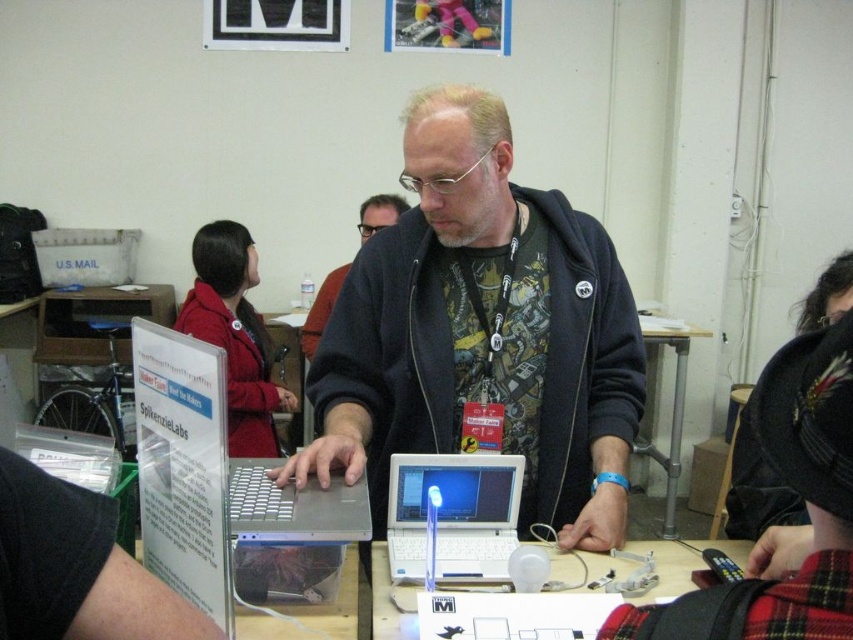
You are standing in front of the SpikenzieLabs display at the maker faire. There are two points marked on the table where the man is demonstrating the laptop. The first point is at coordinate (x=306, y=497) and the second point is at (x=238, y=257). Which point is closer to you?

Point (x=306, y=497) is closer to the viewer than point (x=238, y=257).

You are at a maker faire and want to place a 12 inch promotional banner between the brushed metal sign at upper left and the white plastic laptop at center. Is there enough space?

The distance between the brushed metal sign at upper left and the white plastic laptop at center is 24.00 inches. Since the banner is 12 inches wide, there is enough space to place it between them.

You are a visitor at the maker faire and want to take a photo of the silver metallic laptop at center and the white plastic table at center. Which object is taller when viewed from your perspective?

The silver metallic laptop at center is much taller than the white plastic table at center.